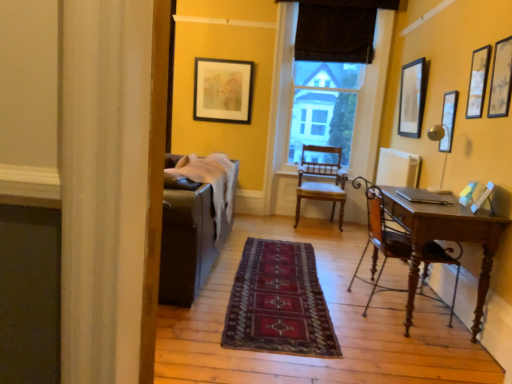
Describe the element at coordinates (321, 182) in the screenshot. The height and width of the screenshot is (384, 512). I see `wooden chair at center, the second chair when ordered from front to back` at that location.

This screenshot has width=512, height=384. What are the coordinates of `metallic silver picture frame at upper right, the third picture frame positioned from the back` in the screenshot? It's located at (448, 120).

In order to face matte black picture frame at upper center, the 1th picture frame in the back-to-front sequence, should I rotate leftwards or rightwards?

Rotate left and turn 4.428 degrees.

Find the location of `matte black picture frame at upper center, the 1th picture frame in the back-to-front sequence`. matte black picture frame at upper center, the 1th picture frame in the back-to-front sequence is located at coordinates (223, 90).

The width and height of the screenshot is (512, 384). What do you see at coordinates (412, 98) in the screenshot? I see `matte black picture frame at upper right, which is the 4th picture frame from front to back` at bounding box center [412, 98].

How much space does matte wooden picture frame at upper right, the first picture frame in the front-to-back sequence, occupy horizontally?

matte wooden picture frame at upper right, the first picture frame in the front-to-back sequence, is 2.09 inches in width.

Image resolution: width=512 pixels, height=384 pixels. Find the location of `dark brown fabric at upper center`. dark brown fabric at upper center is located at coordinates [x=335, y=32].

The height and width of the screenshot is (384, 512). What do you see at coordinates (335, 32) in the screenshot?
I see `dark brown fabric at upper center` at bounding box center [335, 32].

This screenshot has width=512, height=384. What are the coordinates of `wooden chair at center, the second chair when ordered from front to back` in the screenshot? It's located at (321, 182).

Which object is positioned more to the left, matte black picture frame at upper right, positioned as the second picture frame in front-to-back order, or dark red woven rug at center?

dark red woven rug at center is more to the left.

Is point (477, 102) closer to camera compared to point (316, 274)?

Yes.

Does matte black picture frame at upper right, arranged as the third picture frame when viewed from the left, touch dark red woven rug at center?

No, matte black picture frame at upper right, arranged as the third picture frame when viewed from the left, is not in contact with dark red woven rug at center.

Can we say dark brown fabric at upper center lies outside matte black picture frame at upper center, the 1th picture frame in the back-to-front sequence?

Absolutely, dark brown fabric at upper center is external to matte black picture frame at upper center, the 1th picture frame in the back-to-front sequence.

From the image's perspective, starting from the dark brown fabric at upper center, which picture frame is the 1st one below? Please provide its 2D coordinates.

[(223, 90)]

From the image's perspective, is dark brown fabric at upper center above or below matte black picture frame at upper center, the 1th picture frame in the back-to-front sequence?

Based on their image positions, dark brown fabric at upper center is located above matte black picture frame at upper center, the 1th picture frame in the back-to-front sequence.

Is dark brown fabric at upper center far from matte black picture frame at upper center, which appears as the fifth picture frame when viewed from the front?

Absolutely, dark brown fabric at upper center is distant from matte black picture frame at upper center, which appears as the fifth picture frame when viewed from the front.

Is matte black picture frame at upper right, which is the 4th picture frame from front to back, bigger or smaller than wooden chair at center, the second chair when ordered from front to back?

matte black picture frame at upper right, which is the 4th picture frame from front to back, is smaller than wooden chair at center, the second chair when ordered from front to back.

Who is more distant, matte black picture frame at upper right, acting as the 5th picture frame starting from the left, or wooden chair at center, the second chair when ordered from front to back?

wooden chair at center, the second chair when ordered from front to back.

Which is behind, point (411, 101) or point (333, 215)?

Positioned behind is point (333, 215).

Is the surface of dark red woven rug at center in direct contact with wooden chair at center, the second chair when ordered from front to back?

No, dark red woven rug at center is not in contact with wooden chair at center, the second chair when ordered from front to back.

Which object is wider, dark red woven rug at center or wooden chair at center, the 1th chair from the back?

Wider between the two is dark red woven rug at center.

From the picture: Which of these two, dark red woven rug at center or wooden chair at center, the second chair when ordered from front to back, stands taller?

Standing taller between the two is wooden chair at center, the second chair when ordered from front to back.

From the image's perspective, which object appears higher, dark red woven rug at center or wooden chair at center, the 1th chair from the back?

wooden chair at center, the 1th chair from the back, appears higher in the image.

Considering the sizes of objects dark brown fabric at upper center and wooden chair at center, the 1th chair from the back, in the image provided, who is bigger, dark brown fabric at upper center or wooden chair at center, the 1th chair from the back,?

With larger size is wooden chair at center, the 1th chair from the back.

Between dark brown fabric at upper center and wooden chair at center, the 1th chair from the back, which one appears on the left side from the viewer's perspective?

wooden chair at center, the 1th chair from the back.

From the image's perspective, which is above, dark brown fabric at upper center or wooden chair at center, the second chair when ordered from front to back?

dark brown fabric at upper center appears higher in the image.

Is dark brown fabric at upper center positioned far away from wooden chair at center, the 1th chair from the back?

Indeed, dark brown fabric at upper center is not near wooden chair at center, the 1th chair from the back.

From a real-world perspective, is wooden chair at right, marked as the 2th chair in a back-to-front arrangement, positioned under matte black picture frame at upper center, which appears as the fifth picture frame when viewed from the front, based on gravity?

Yes, from a real-world perspective, wooden chair at right, marked as the 2th chair in a back-to-front arrangement, is beneath matte black picture frame at upper center, which appears as the fifth picture frame when viewed from the front.

Who is taller, wooden chair at right, the 1th chair when ordered from front to back, or matte black picture frame at upper center, which is counted as the first picture frame, starting from the left?

wooden chair at right, the 1th chair when ordered from front to back.

Is wooden chair at right, marked as the 2th chair in a back-to-front arrangement, thinner than matte black picture frame at upper center, which is counted as the first picture frame, starting from the left?

No, wooden chair at right, marked as the 2th chair in a back-to-front arrangement, is not thinner than matte black picture frame at upper center, which is counted as the first picture frame, starting from the left.

Which is more to the left, wooden chair at right, the 1th chair when ordered from front to back, or matte black picture frame at upper center, which appears as the fifth picture frame when viewed from the front?

Positioned to the left is matte black picture frame at upper center, which appears as the fifth picture frame when viewed from the front.

Can you confirm if matte black picture frame at upper right, which is the 1th picture frame in right-to-left order, is thinner than matte wooden picture frame at upper right, which is the fourth picture frame from right to left?

→ Incorrect, the width of matte black picture frame at upper right, which is the 1th picture frame in right-to-left order, is not less than that of matte wooden picture frame at upper right, which is the fourth picture frame from right to left.

Is matte black picture frame at upper right, which ranks as the second picture frame in back-to-front order, next to matte wooden picture frame at upper right, which is the fourth picture frame from right to left?

matte black picture frame at upper right, which ranks as the second picture frame in back-to-front order, is not next to matte wooden picture frame at upper right, which is the fourth picture frame from right to left, and they're not touching.

What are the coordinates of `picture frame that is the 3rd one when counting leftward from the matte black picture frame at upper right, which is the 4th picture frame from front to back` in the screenshot? It's located at (501, 79).

Considering the relative positions of matte black picture frame at upper right, acting as the 5th picture frame starting from the left, and matte wooden picture frame at upper right, the fifth picture frame when ordered from back to front, in the image provided, is matte black picture frame at upper right, acting as the 5th picture frame starting from the left, to the left of matte wooden picture frame at upper right, the fifth picture frame when ordered from back to front, from the viewer's perspective?

Incorrect, matte black picture frame at upper right, acting as the 5th picture frame starting from the left, is not on the left side of matte wooden picture frame at upper right, the fifth picture frame when ordered from back to front.

Find the location of a particular element. This screenshot has width=512, height=384. mat in front of the matte black picture frame at upper right, positioned as the second picture frame in front-to-back order is located at coordinates (279, 302).

From the image's perspective, starting from the dark brown fabric at upper center, which picture frame is the 1st one below? Please provide its 2D coordinates.

[(223, 90)]

Considering their positions, is metallic silver picture frame at upper right, which ranks as the fourth picture frame in left-to-right order, positioned further to matte black picture frame at upper right, which ranks as the second picture frame in back-to-front order, than wooden chair at center, the 1th chair from the back?

wooden chair at center, the 1th chair from the back, is positioned further to the anchor matte black picture frame at upper right, which ranks as the second picture frame in back-to-front order.

Estimate the real-world distances between objects in this image. Which object is closer to matte wooden picture frame at upper right, the first picture frame in the front-to-back sequence, dark brown fabric at upper center or matte black picture frame at upper center, which is counted as the first picture frame, starting from the left?

Based on the image, dark brown fabric at upper center appears to be nearer to matte wooden picture frame at upper right, the first picture frame in the front-to-back sequence.

From the picture: Looking at the image, which one is located closer to wooden chair at right, the 1th chair when ordered from front to back, metallic silver picture frame at upper right, which ranks as the fourth picture frame in left-to-right order, or dark red woven rug at center?

The object closer to wooden chair at right, the 1th chair when ordered from front to back, is dark red woven rug at center.

Considering their positions, is dark red woven rug at center positioned closer to wooden chair at center, the 1th chair from the back, than matte black picture frame at upper right, acting as the 5th picture frame starting from the left?

matte black picture frame at upper right, acting as the 5th picture frame starting from the left.

From the picture: Considering their positions, is dark brown fabric at upper center positioned further to metallic silver picture frame at upper right, the third picture frame positioned from the back, than dark red woven rug at center?

dark brown fabric at upper center is positioned further to the anchor metallic silver picture frame at upper right, the third picture frame positioned from the back.

Estimate the real-world distances between objects in this image. Which object is closer to metallic silver picture frame at upper right, the third picture frame positioned from the back, wooden chair at center, the 1th chair from the back, or dark brown fabric at center?

Based on the image, wooden chair at center, the 1th chair from the back, appears to be nearer to metallic silver picture frame at upper right, the third picture frame positioned from the back.

From the image, which object appears to be farther from dark red woven rug at center, matte wooden picture frame at upper right, placed as the second picture frame when sorted from left to right, or matte black picture frame at upper right, which ranks as the second picture frame in back-to-front order?

Among the two, matte black picture frame at upper right, which ranks as the second picture frame in back-to-front order, is located further to dark red woven rug at center.

When comparing their distances from matte black picture frame at upper center, the 1th picture frame in the back-to-front sequence, does dark brown fabric at upper center or dark brown fabric at center seem further?

The object further to matte black picture frame at upper center, the 1th picture frame in the back-to-front sequence, is dark brown fabric at center.

Where is `curtain between metallic silver picture frame at upper right, the second picture frame viewed from the right, and dark brown fabric at center, along the z-axis`? This screenshot has width=512, height=384. curtain between metallic silver picture frame at upper right, the second picture frame viewed from the right, and dark brown fabric at center, along the z-axis is located at coordinates [335, 32].

The image size is (512, 384). In order to click on chair located between matte black picture frame at upper right, which is the 4th picture frame from front to back, and dark brown fabric at center in the depth direction in this screenshot , I will do `click(321, 182)`.

Find the location of a particular element. This screenshot has height=384, width=512. picture frame between matte wooden picture frame at upper right, the first picture frame in the front-to-back sequence, and wooden chair at right, the 1th chair when ordered from front to back, from top to bottom is located at coordinates (448, 120).

Image resolution: width=512 pixels, height=384 pixels. I want to click on chair positioned between metallic silver picture frame at upper right, placed as the third picture frame when sorted from front to back, and dark brown fabric at center from near to far, so click(x=321, y=182).